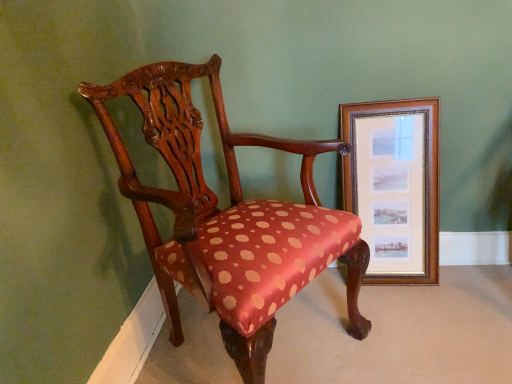
Question: From a real-world perspective, is polished wood chair at center physically above wooden frame at right?

Choices:
 (A) no
 (B) yes

Answer: (B)

Question: From the image's perspective, is polished wood chair at center beneath wooden frame at right?

Choices:
 (A) no
 (B) yes

Answer: (B)

Question: Considering the relative sizes of polished wood chair at center and wooden frame at right in the image provided, is polished wood chair at center smaller than wooden frame at right?

Choices:
 (A) yes
 (B) no

Answer: (B)

Question: Is polished wood chair at center beside wooden frame at right?

Choices:
 (A) yes
 (B) no

Answer: (B)

Question: Is polished wood chair at center located outside wooden frame at right?

Choices:
 (A) no
 (B) yes

Answer: (B)

Question: Does polished wood chair at center have a larger size compared to wooden frame at right?

Choices:
 (A) yes
 (B) no

Answer: (A)

Question: Can you confirm if wooden frame at right is positioned to the left of polished wood chair at center?

Choices:
 (A) no
 (B) yes

Answer: (A)

Question: Considering the relative sizes of wooden frame at right and polished wood chair at center in the image provided, is wooden frame at right smaller than polished wood chair at center?

Choices:
 (A) no
 (B) yes

Answer: (B)

Question: From the image's perspective, is wooden frame at right above polished wood chair at center?

Choices:
 (A) yes
 (B) no

Answer: (A)

Question: Is wooden frame at right facing towards polished wood chair at center?

Choices:
 (A) no
 (B) yes

Answer: (A)

Question: Does wooden frame at right have a greater width compared to polished wood chair at center?

Choices:
 (A) no
 (B) yes

Answer: (A)

Question: Considering the relative positions of wooden frame at right and polished wood chair at center in the image provided, is wooden frame at right in front of polished wood chair at center?

Choices:
 (A) no
 (B) yes

Answer: (A)

Question: From a real-world perspective, is polished wood chair at center positioned above or below wooden frame at right?

Choices:
 (A) below
 (B) above

Answer: (B)